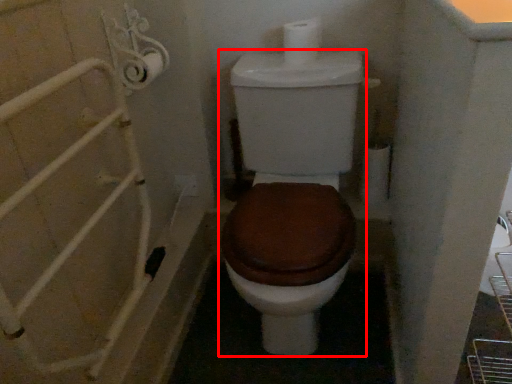
Question: From the image's perspective, considering the relative positions of toilet (annotated by the red box) and toilet paper in the image provided, where is toilet (annotated by the red box) located with respect to the staircase?

Choices:
 (A) above
 (B) below

Answer: (B)